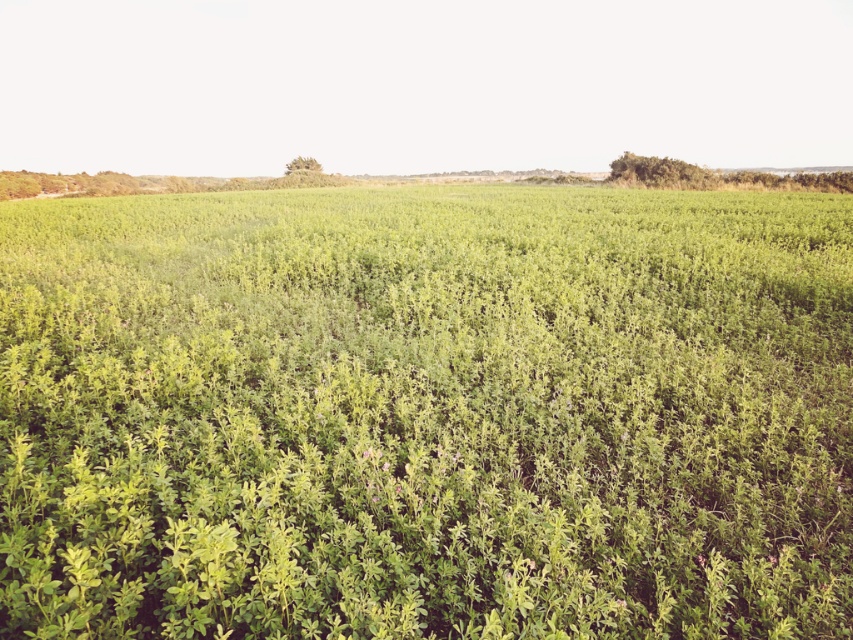
Is green leafy grass at center further to the viewer compared to green leafy bush at upper right?

No, it is in front of green leafy bush at upper right.

Find the location of a particular element. green leafy grass at center is located at coordinates (426, 413).

Identify the location of green leafy grass at center. The width and height of the screenshot is (853, 640). (426, 413).

Does green leafy grass at center appear on the left side of green leafy bush at upper center?

In fact, green leafy grass at center is to the right of green leafy bush at upper center.

Who is more forward, (537, 634) or (306, 168)?

Point (537, 634) is in front.

The height and width of the screenshot is (640, 853). Identify the location of green leafy grass at center. (426, 413).

Who is positioned more to the left, green leafy bush at upper right or green leafy bush at upper center?

green leafy bush at upper center is more to the left.

What are the coordinates of `green leafy bush at upper right` in the screenshot? It's located at tap(660, 172).